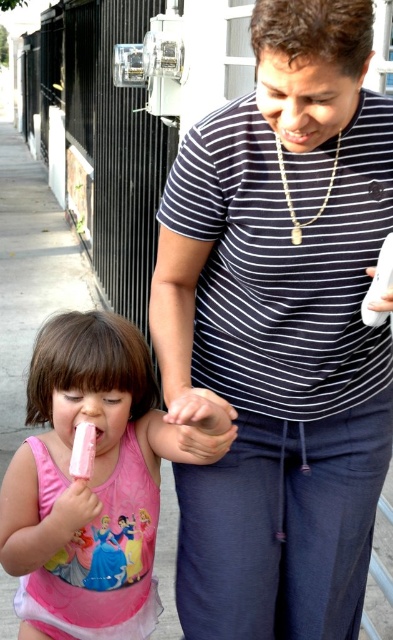
Based on the scene description, where is the striped cotton shirt at center located in terms of its 2D coordinates?

The striped cotton shirt at center is located at the 2D coordinates of point (282, 332).

You are standing in the scene and want to hand a water bottle to both the striped cotton shirt at center and the pink matte swimsuit at lower left. Which person should you give the water bottle to first based on their proximity to you?

You should give the water bottle to the striped cotton shirt at center first because they are closer to you than the pink matte swimsuit at lower left.